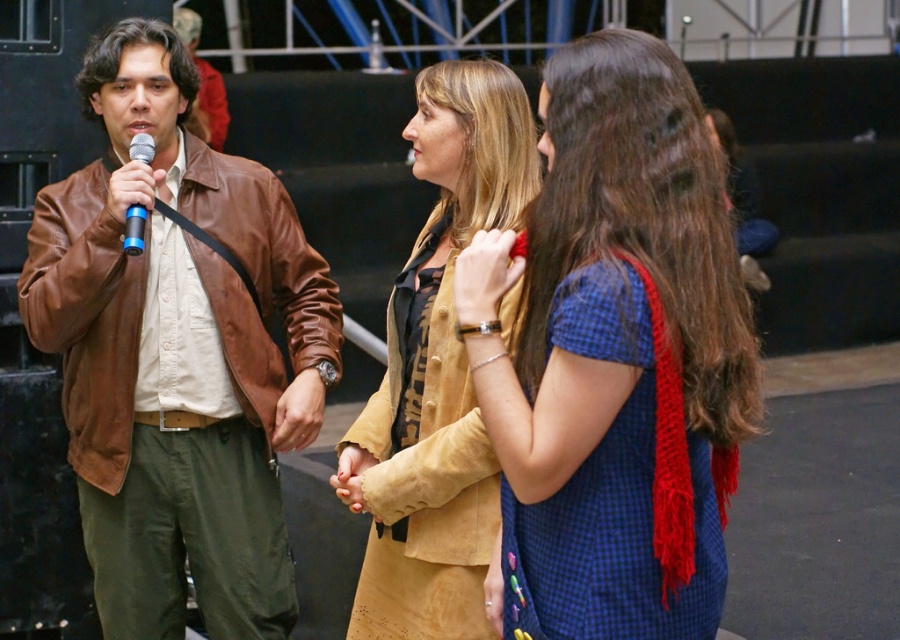
Is blue checkered dress at center positioned behind blue metallic microphone at left?

No, it is in front of blue metallic microphone at left.

Is point (534, 586) positioned before point (124, 243)?

That is True.

Which is behind, point (492, 298) or point (145, 156)?

The point (145, 156) is more distant.

Where is `blue checkered dress at center`? blue checkered dress at center is located at coordinates (614, 355).

Who is positioned more to the right, suede jacket at center or blue metallic microphone at left?

suede jacket at center is more to the right.

Does suede jacket at center have a greater width compared to blue metallic microphone at left?

Yes, suede jacket at center is wider than blue metallic microphone at left.

Find the location of a particular element. The width and height of the screenshot is (900, 640). suede jacket at center is located at coordinates (437, 372).

From the picture: Does brown leather jacket at left appear on the right side of suede jacket at center?

In fact, brown leather jacket at left is to the left of suede jacket at center.

Is brown leather jacket at left shorter than suede jacket at center?

Incorrect, brown leather jacket at left's height does not fall short of suede jacket at center's.

Does point (79, 173) come behind point (396, 385)?

Yes.

This screenshot has width=900, height=640. I want to click on brown leather jacket at left, so click(x=177, y=353).